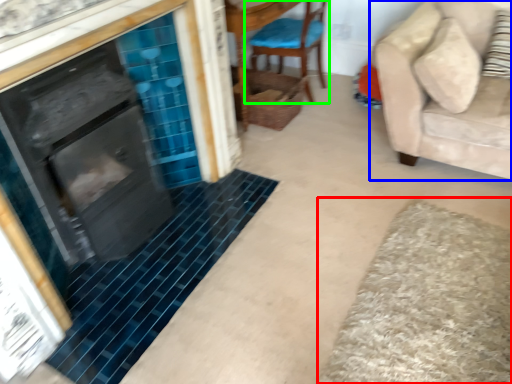
Question: Estimate the real-world distances between objects in this image. Which object is closer to bath mat (highlighted by a red box), studio couch (highlighted by a blue box) or chair (highlighted by a green box)?

Choices:
 (A) studio couch
 (B) chair

Answer: (A)